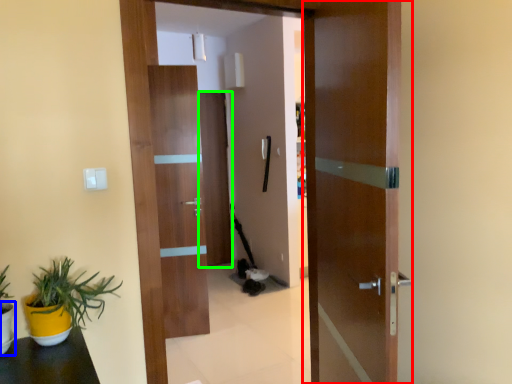
Question: Which object is positioned farthest from door (highlighted by a red box)? Select from flowerpot (highlighted by a blue box) and door (highlighted by a green box).

Choices:
 (A) flowerpot
 (B) door

Answer: (B)